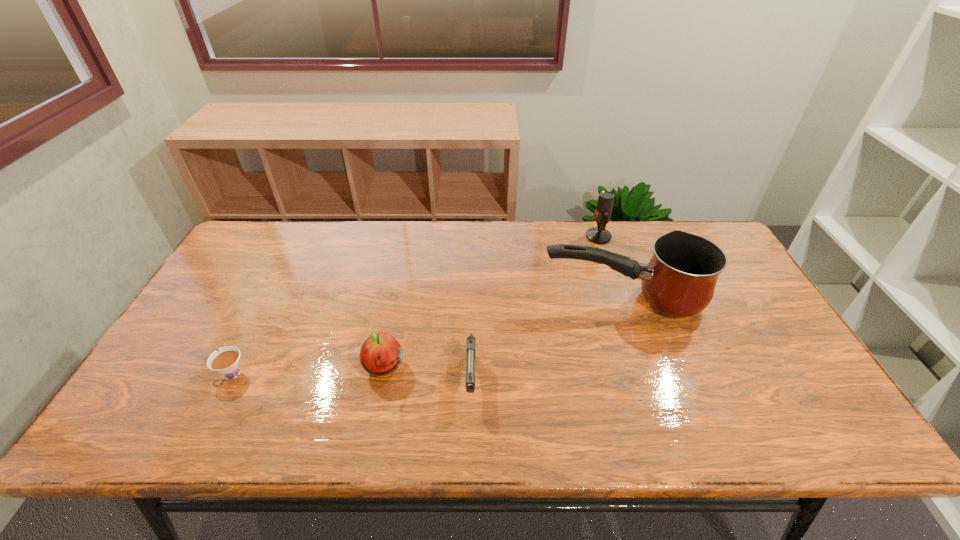
Identify the location of object that is at the right edge. The image size is (960, 540). (680, 279).

Locate an element on the screen. This screenshot has width=960, height=540. free space at the far edge is located at coordinates (560, 220).

Locate an element on the screen. blank space at the near edge of the desktop is located at coordinates (701, 441).

You are a GUI agent. You are given a task and a screenshot of the screen. Output one action in this format:
    pyautogui.click(x=<x>, y=<y>)
    Task: Click on the vacant region at the left edge of the desktop
    The height and width of the screenshot is (540, 960).
    Given the screenshot: What is the action you would take?
    pyautogui.click(x=248, y=299)

This screenshot has width=960, height=540. Identify the location of vacant space at the far left corner. (252, 257).

The width and height of the screenshot is (960, 540). I want to click on vacant space at the far right corner of the desktop, so click(674, 226).

The image size is (960, 540). What are the coordinates of `free point between the shortest object and the farthest object` in the screenshot? It's located at (415, 305).

The height and width of the screenshot is (540, 960). I want to click on vacant region between the third object from right to left and the farthest object, so click(x=535, y=308).

This screenshot has width=960, height=540. Find the location of `empty space between the second object from left to right and the third object from left to right`. empty space between the second object from left to right and the third object from left to right is located at coordinates (427, 374).

Where is `vacant space that's between the fourth object from right to left and the third object from left to right`? Image resolution: width=960 pixels, height=540 pixels. vacant space that's between the fourth object from right to left and the third object from left to right is located at coordinates (427, 374).